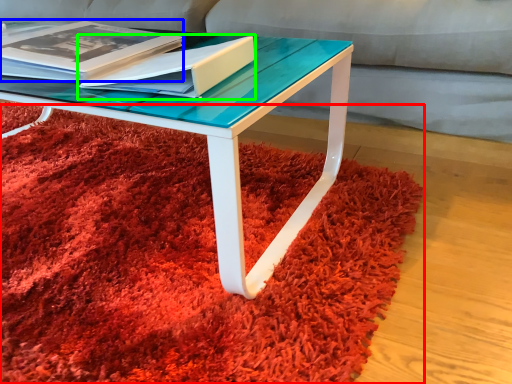
Question: Considering the real-world distances, which object is farthest from mat (highlighted by a red box)? magazine (highlighted by a blue box) or paperback book (highlighted by a green box)?

Choices:
 (A) magazine
 (B) paperback book

Answer: (A)